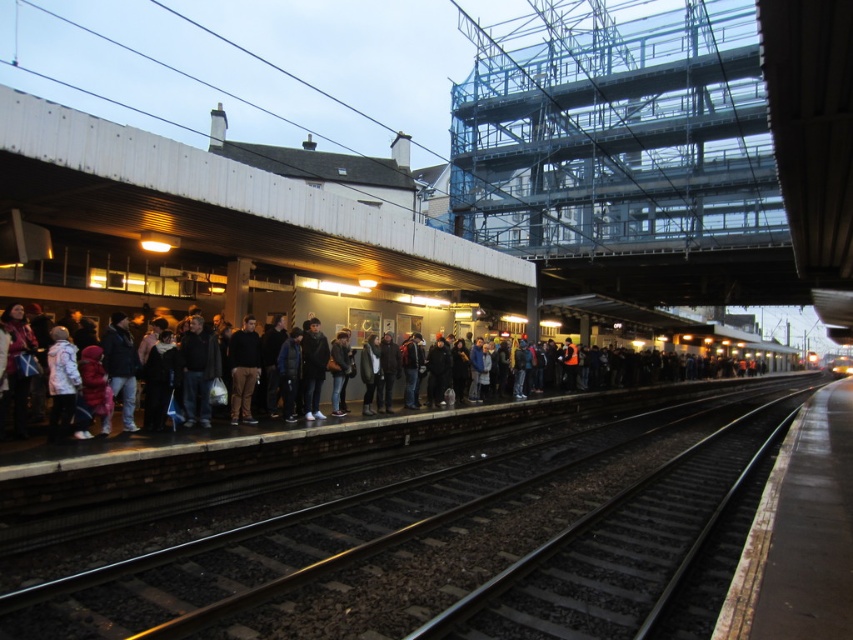
Question: Can you confirm if black metal track at center is wider than yellow metallic train at center?

Choices:
 (A) yes
 (B) no

Answer: (B)

Question: Is black metal track at center to the left of dark gray jacket at left from the viewer's perspective?

Choices:
 (A) no
 (B) yes

Answer: (B)

Question: Considering the real-world distances, which object is closest to the dark gray jacket at left?

Choices:
 (A) black metal track at center
 (B) yellow metallic train at center

Answer: (A)

Question: Which of the following is the closest to the observer?

Choices:
 (A) black metal track at center
 (B) dark gray jacket at left

Answer: (A)

Question: Estimate the real-world distances between objects in this image. Which object is farther from the dark gray jacket at left?

Choices:
 (A) black metal track at center
 (B) yellow metallic train at center

Answer: (B)

Question: Where is black metal track at center located in relation to dark gray jacket at left in the image?

Choices:
 (A) right
 (B) left

Answer: (B)